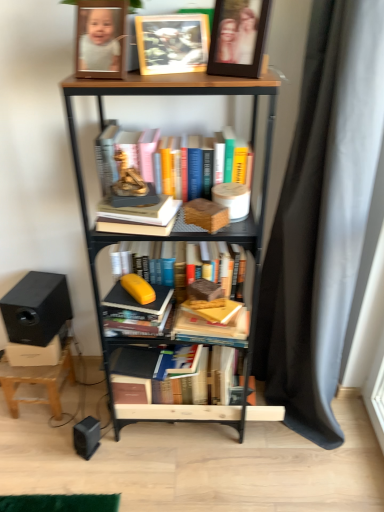
This screenshot has width=384, height=512. I want to click on wooden statue at center, so click(x=128, y=178).

What do you see at coordinates (214, 322) in the screenshot? I see `hardcover book at center, placed as the 3th book when sorted from top to bottom` at bounding box center [214, 322].

Where is `black fabric curtain at right`? This screenshot has height=512, width=384. black fabric curtain at right is located at coordinates (322, 216).

Locate an element on the screen. The width and height of the screenshot is (384, 512). wooden stool at lower left is located at coordinates (38, 381).

This screenshot has width=384, height=512. What do you see at coordinates (213, 322) in the screenshot?
I see `hardcover book at center, which ranks as the first book in bottom-to-top order` at bounding box center [213, 322].

What do you see at coordinates (36, 308) in the screenshot?
I see `black matte speaker at lower left, which is the second speaker from bottom to top` at bounding box center [36, 308].

From the picture: How much space does black matte speaker at lower left, positioned as the first speaker in top-to-bottom order, occupy vertically?

black matte speaker at lower left, positioned as the first speaker in top-to-bottom order, is 7.85 inches in height.

Where is `wooden statue at center`? This screenshot has height=512, width=384. wooden statue at center is located at coordinates (128, 178).

Is wooden stool at lower left further to camera compared to wooden bookcase at center?

Yes, wooden stool at lower left is further from the camera.

In terms of size, does wooden stool at lower left appear bigger or smaller than wooden bookcase at center?

Considering their sizes, wooden stool at lower left takes up less space than wooden bookcase at center.

From a real-world perspective, between wooden stool at lower left and wooden bookcase at center, who is vertically higher?

From a 3D spatial view, wooden bookcase at center is above.

Considering the points (52, 412) and (253, 147), which point is behind, point (52, 412) or point (253, 147)?

The point (52, 412) is farther.

From a real-world perspective, is wooden paperback book at center positioned over wooden statue at center based on gravity?

No, from a real-world perspective, wooden paperback book at center is not on top of wooden statue at center.

Which object is wider, wooden paperback book at center or wooden statue at center?

Wider between the two is wooden paperback book at center.

Is wooden paperback book at center in contact with wooden statue at center?

wooden paperback book at center is not next to wooden statue at center, and they're not touching.

Is point (213, 333) behind point (121, 183)?

Yes, point (213, 333) is behind point (121, 183).

Considering the relative sizes of hardcover book at center, which ranks as the first book in bottom-to-top order, and wooden statue at center in the image provided, is hardcover book at center, which ranks as the first book in bottom-to-top order, thinner than wooden statue at center?

In fact, hardcover book at center, which ranks as the first book in bottom-to-top order, might be wider than wooden statue at center.

Would you say hardcover book at center, the 4th book from the top, is outside wooden statue at center?

Yes, hardcover book at center, the 4th book from the top, is outside of wooden statue at center.

Considering the sizes of hardcover book at center, the 4th book from the top, and wooden statue at center in the image, is hardcover book at center, the 4th book from the top, bigger or smaller than wooden statue at center?

Considering their sizes, hardcover book at center, the 4th book from the top, takes up more space than wooden statue at center.

Based on the photo, which is more to the left, hardcover book at center, acting as the 2th book starting from the top, or wooden stool at lower left?

Positioned to the left is wooden stool at lower left.

Looking at this image, from the image's perspective, is hardcover book at center, acting as the 2th book starting from the top, below wooden stool at lower left?

Incorrect, from the image's perspective, hardcover book at center, acting as the 2th book starting from the top, is higher than wooden stool at lower left.

Considering the relative sizes of hardcover book at center, the 3th book ordered from the bottom, and wooden stool at lower left in the image provided, is hardcover book at center, the 3th book ordered from the bottom, wider than wooden stool at lower left?

Incorrect, the width of hardcover book at center, the 3th book ordered from the bottom, does not surpass that of wooden stool at lower left.

In terms of size, does hardcover book at center, the 3th book ordered from the bottom, appear bigger or smaller than wooden stool at lower left?

In the image, hardcover book at center, the 3th book ordered from the bottom, appears to be smaller than wooden stool at lower left.

Is the depth of black fabric curtain at right greater than that of wooden picture frame at upper center, acting as the first picture frame starting from the right?

That is False.

From the image's perspective, which is above, black fabric curtain at right or wooden picture frame at upper center, acting as the first picture frame starting from the right?

wooden picture frame at upper center, acting as the first picture frame starting from the right, is shown above in the image.

Is wooden bookcase at center at the back of wooden paperback book at center?

Yes, wooden paperback book at center's orientation is away from wooden bookcase at center.

Who is smaller, wooden paperback book at center or wooden bookcase at center?

wooden paperback book at center.

Is the position of wooden paperback book at center less distant than that of wooden bookcase at center?

No, wooden paperback book at center is behind wooden bookcase at center.

Which object is further away from the camera, black fabric curtain at right or black plastic speaker at lower left, marked as the first speaker in a bottom-to-top arrangement?

Positioned behind is black plastic speaker at lower left, marked as the first speaker in a bottom-to-top arrangement.

Would you say black fabric curtain at right is to the left or to the right of black plastic speaker at lower left, the 2th speaker from the top, in the picture?

In the image, black fabric curtain at right appears on the right side of black plastic speaker at lower left, the 2th speaker from the top.

Who is smaller, black fabric curtain at right or black plastic speaker at lower left, the first speaker in the right-to-left sequence?

Smaller between the two is black plastic speaker at lower left, the first speaker in the right-to-left sequence.

Looking at this image, is black fabric curtain at right looking in the opposite direction of black plastic speaker at lower left, the 2th speaker from the top?

Answer: black fabric curtain at right is not turned away from black plastic speaker at lower left, the 2th speaker from the top.

Identify the location of bookcase located above the wooden stool at lower left (from a real-world perspective). The image size is (384, 512). (172, 95).

Find the location of a particular element. Image resolution: width=384 pixels, height=512 pixels. paperback book below the wooden statue at center (from the image's perspective) is located at coordinates (206, 214).

From the image, which object appears to be farther from black fabric curtain at right, hardcover book at center, the 3th book ordered from the bottom, or wooden photo frame at upper center, the 2th picture frame from the right?

wooden photo frame at upper center, the 2th picture frame from the right.

Estimate the real-world distances between objects in this image. Which object is closer to hardcover book at center, the 4th book from the top, wooden paperback book at center or hardcover book at center, the 3th book ordered from the bottom?

wooden paperback book at center lies closer to hardcover book at center, the 4th book from the top, than the other object.

From the image, which object appears to be farther from hardcover book at center, the 3th book ordered from the bottom, wooden paperback book at center or hardcover books at center, positioned as the 1th book in top-to-bottom order?

hardcover books at center, positioned as the 1th book in top-to-bottom order, is further to hardcover book at center, the 3th book ordered from the bottom.

Which object lies nearer to the anchor point wooden picture frame at upper center, arranged as the 2th picture frame when viewed from the left, wooden statue at center or black matte speaker at lower left, which is the 2th speaker in right-to-left order?

wooden statue at center lies closer to wooden picture frame at upper center, arranged as the 2th picture frame when viewed from the left, than the other object.

Considering their positions, is wooden paperback book at center positioned closer to wooden picture frame at upper center, acting as the first picture frame starting from the right, than black plastic speaker at lower left, which appears as the 2th speaker when viewed from the left?

wooden paperback book at center.

Looking at the image, which one is located closer to hardcover book at center, placed as the second book when sorted from bottom to top, hardcover book at center, acting as the 2th book starting from the top, or black fabric curtain at right?

hardcover book at center, acting as the 2th book starting from the top, is closer to hardcover book at center, placed as the second book when sorted from bottom to top.

When comparing their distances from wooden stool at lower left, does wooden picture frame at upper center, acting as the first picture frame starting from the right, or black plastic speaker at lower left, which appears as the 2th speaker when viewed from the left, seem closer?

Based on the image, black plastic speaker at lower left, which appears as the 2th speaker when viewed from the left, appears to be nearer to wooden stool at lower left.

Estimate the real-world distances between objects in this image. Which object is closer to hardcover books at center, positioned as the 1th book in top-to-bottom order, black plastic speaker at lower left, which appears as the 2th speaker when viewed from the left, or hardcover book at center, placed as the 3th book when sorted from top to bottom?

hardcover book at center, placed as the 3th book when sorted from top to bottom, is positioned closer to the anchor hardcover books at center, positioned as the 1th book in top-to-bottom order.

In order to click on speaker between wooden statue at center and wooden stool at lower left from top to bottom in this screenshot , I will do `click(36, 308)`.

Identify the location of speaker between wooden paperback book at center and black plastic speaker at lower left, marked as the first speaker in a bottom-to-top arrangement, in the vertical direction. (36, 308).

Where is `paperback book that lies between wooden photo frame at upper center, the 2th picture frame from the right, and black fabric curtain at right from top to bottom`? This screenshot has height=512, width=384. paperback book that lies between wooden photo frame at upper center, the 2th picture frame from the right, and black fabric curtain at right from top to bottom is located at coordinates (206, 214).

Where is `toy located between black matte speaker at lower left, which is the 1th speaker in left-to-right order, and black fabric curtain at right in the left-right direction`? toy located between black matte speaker at lower left, which is the 1th speaker in left-to-right order, and black fabric curtain at right in the left-right direction is located at coordinates (128, 178).